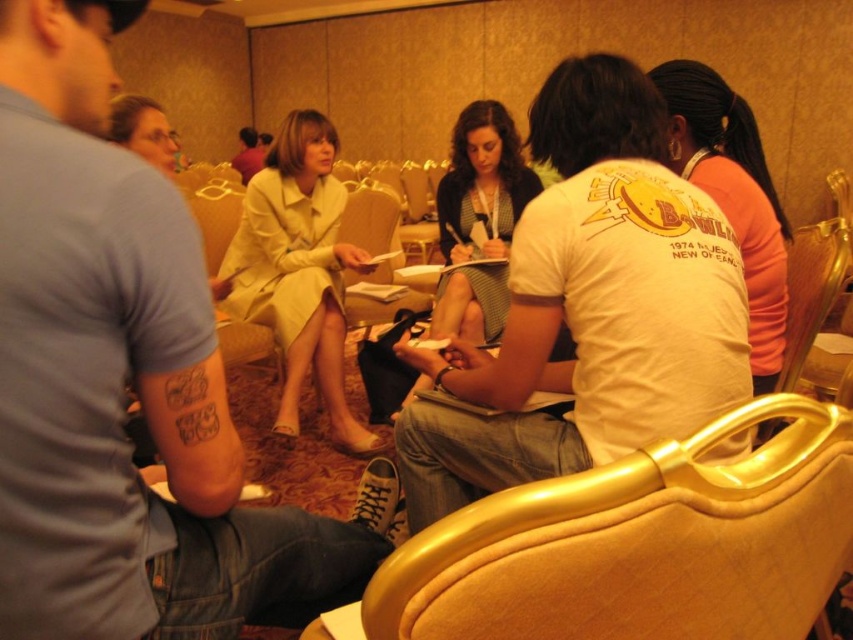
Question: Among these points, which one is farthest from the camera?

Choices:
 (A) (711, 74)
 (B) (291, 269)

Answer: (B)

Question: From the image, what is the correct spatial relationship of denim jeans at center in relation to matte black dress at center?

Choices:
 (A) above
 (B) below

Answer: (B)

Question: Is matte black dress at center to the left of light beige suit at center from the viewer's perspective?

Choices:
 (A) no
 (B) yes

Answer: (A)

Question: Which point appears farthest from the camera in this image?

Choices:
 (A) (16, 99)
 (B) (459, 257)
 (C) (288, 323)
 (D) (251, 163)

Answer: (D)

Question: Which point is closer to the camera?

Choices:
 (A) (236, 259)
 (B) (497, 168)
 (C) (200, 580)
 (D) (254, 168)

Answer: (C)

Question: Is white matte shirt at upper right thinner than light beige suit at center?

Choices:
 (A) no
 (B) yes

Answer: (B)